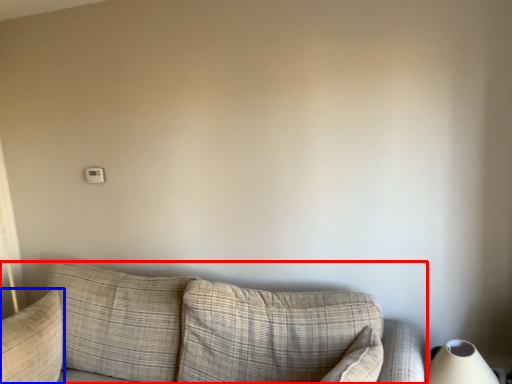
Question: Which point is further to the camera, studio couch (highlighted by a red box) or pillow (highlighted by a blue box)?

Choices:
 (A) studio couch
 (B) pillow

Answer: (B)